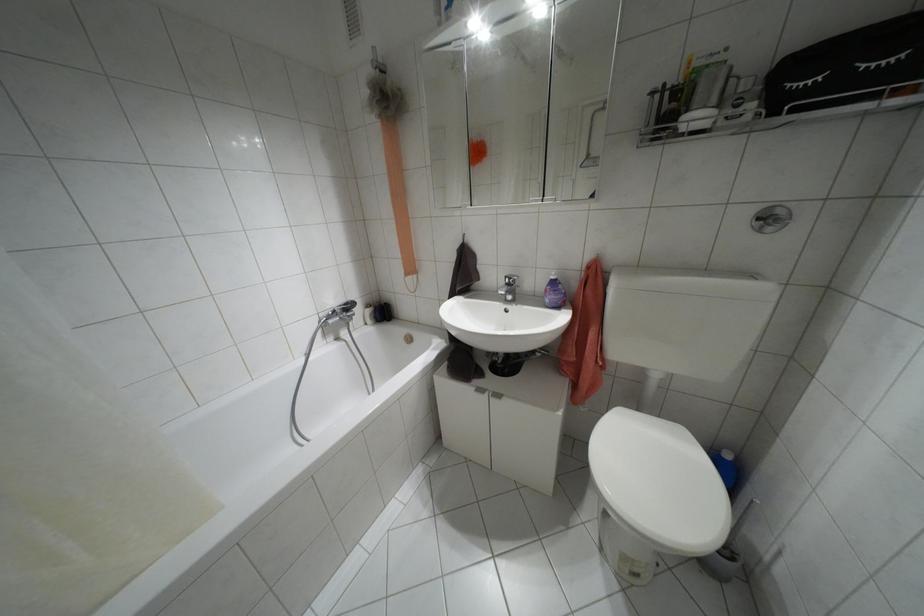
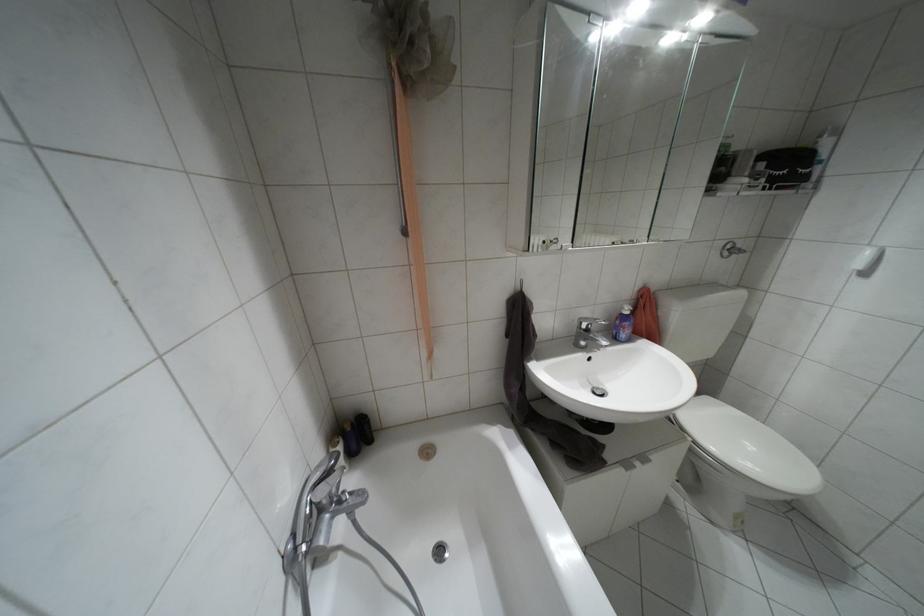
The point at (507,284) is marked in the first image. Where is the corresponding point in the second image?

(587, 330)